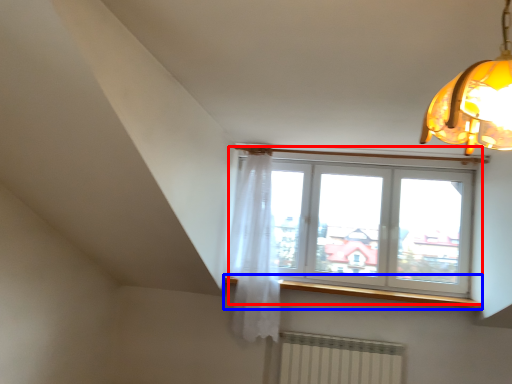
Question: Which point is closer to the camera, window (highlighted by a red box) or window sill (highlighted by a blue box)?

Choices:
 (A) window
 (B) window sill

Answer: (B)